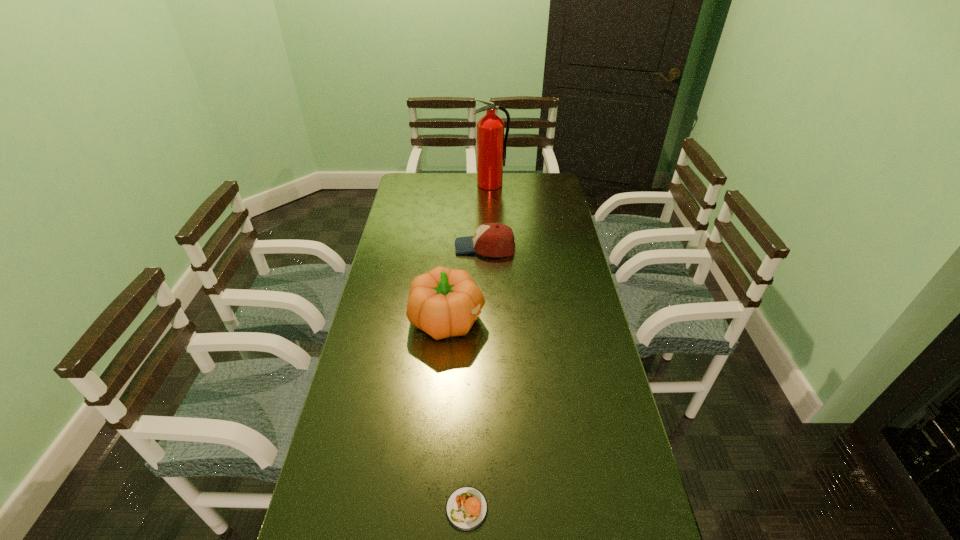
At what (x,y) coordinates should I click in order to perform the action: click on free space in the image that satisfies the following two spatial constraints: 1. at the nozzle of the fire extinguisher; 2. on the front-facing side of the baseball cap. Please return your answer as a coordinate pair (x, y). The width and height of the screenshot is (960, 540). Looking at the image, I should click on (493, 247).

Find the location of `free space that satisfies the following two spatial constraints: 1. on the front-facing side of the second shortest object; 2. on the front side of the patty`. free space that satisfies the following two spatial constraints: 1. on the front-facing side of the second shortest object; 2. on the front side of the patty is located at coordinates (489, 509).

At what (x,y) coordinates should I click in order to perform the action: click on vacant region that satisfies the following two spatial constraints: 1. on the front-facing side of the third nearest object; 2. on the front side of the patty. Please return your answer as a coordinate pair (x, y). Looking at the image, I should click on (489, 509).

Where is `vacant point that satisfies the following two spatial constraints: 1. on the carved face of the patty; 2. on the left side of the third shortest object`? The width and height of the screenshot is (960, 540). vacant point that satisfies the following two spatial constraints: 1. on the carved face of the patty; 2. on the left side of the third shortest object is located at coordinates (433, 509).